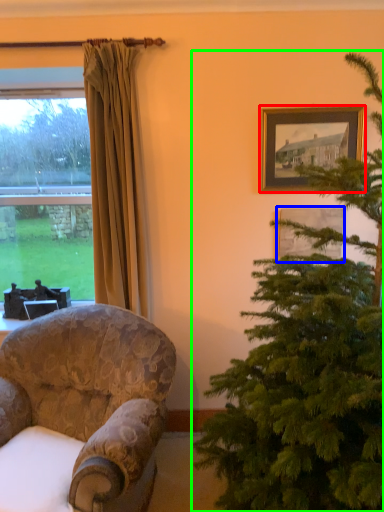
Question: Based on their relative distances, which object is farther from picture frame (highlighted by a red box)? Choose from picture frame (highlighted by a blue box) and christmas tree (highlighted by a green box).

Choices:
 (A) picture frame
 (B) christmas tree

Answer: (B)